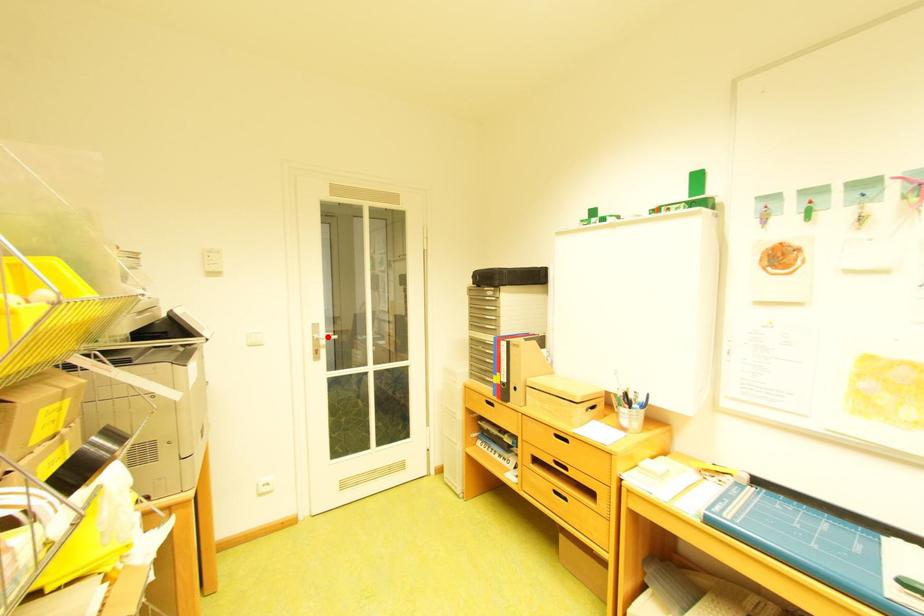
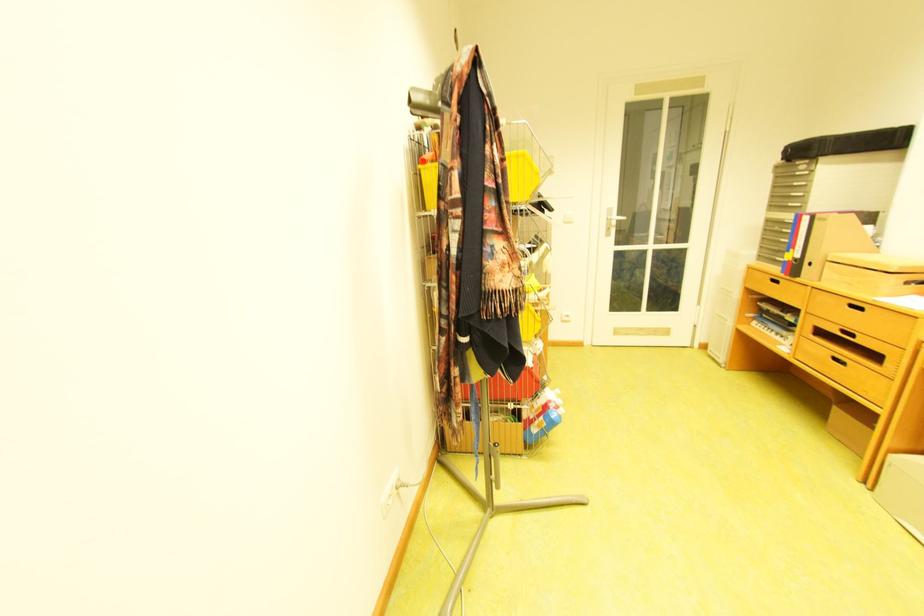
In the second image, find the point that corresponds to the highlighted location in the first image.

(621, 217)